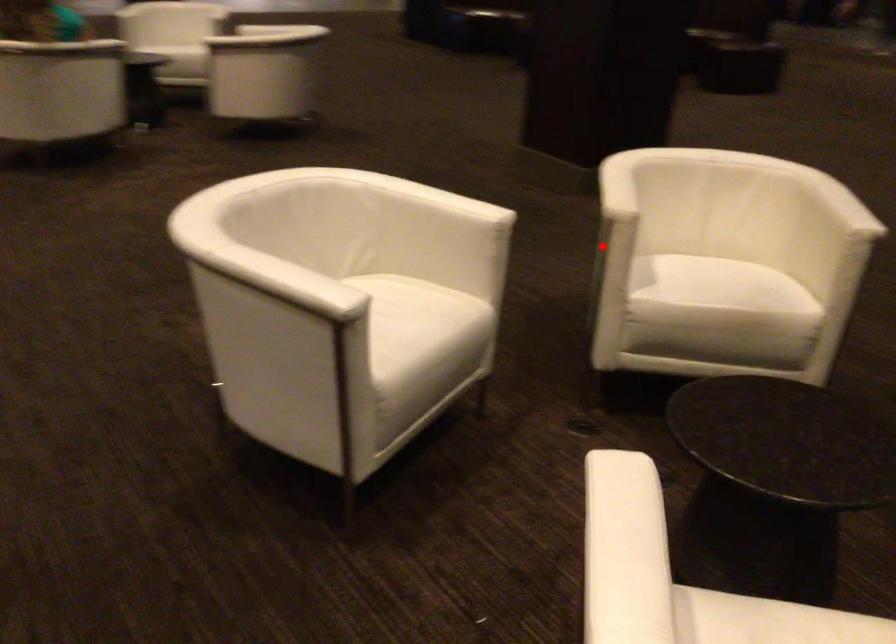
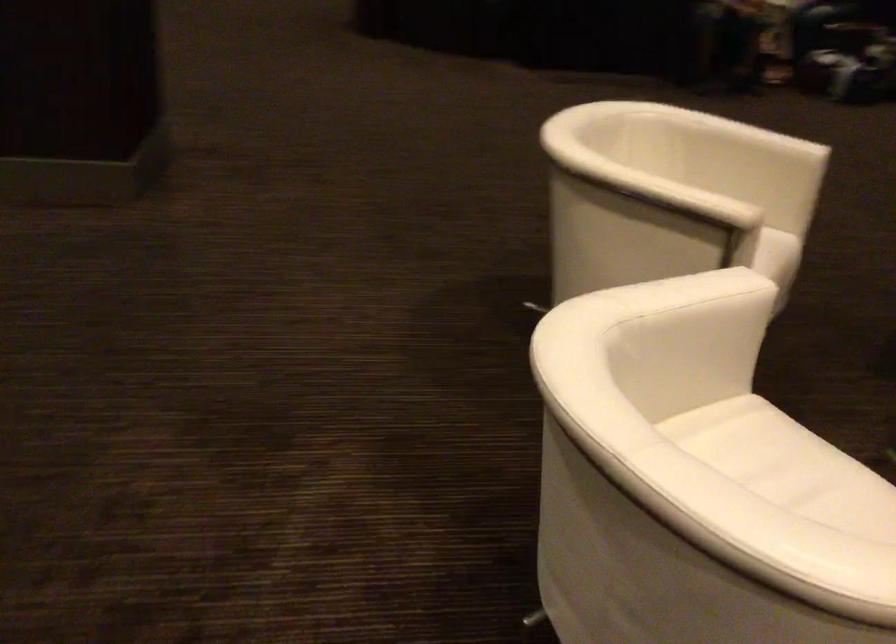
Where in the second image is the point corresponding to the highlighted location from the first image?

(676, 261)